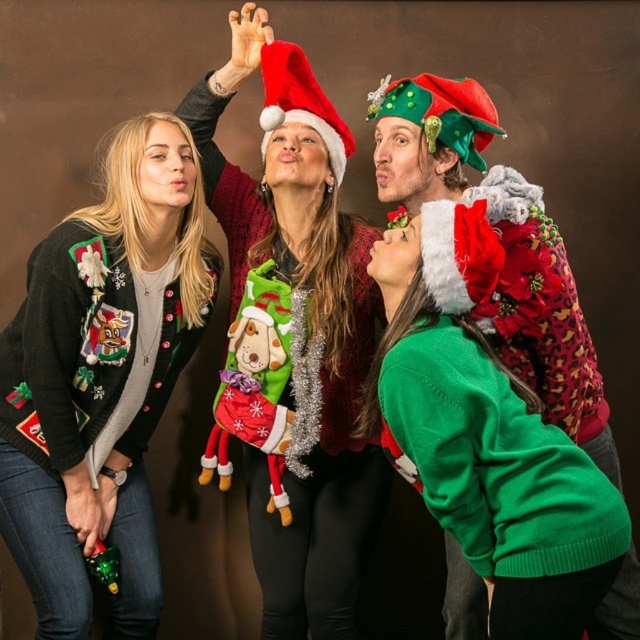
Who is positioned more to the right, fuzzy red santa hat at center or matte black sweater at left?

fuzzy red santa hat at center

Is point (232, 374) more distant than point (157, 355)?

No, it is in front of (157, 355).

Locate an element on the screen. Image resolution: width=640 pixels, height=640 pixels. fuzzy red santa hat at center is located at coordinates (292, 337).

Can you confirm if green fuzzy sweater at center is positioned above green felt christmas hat at upper center?

Actually, green fuzzy sweater at center is below green felt christmas hat at upper center.

In order to click on green fuzzy sweater at center in this screenshot , I will do `click(499, 246)`.

Who is positioned more to the left, matte black sweater at left or red velvet santa hat at center?

Positioned to the left is matte black sweater at left.

The image size is (640, 640). I want to click on matte black sweater at left, so click(100, 378).